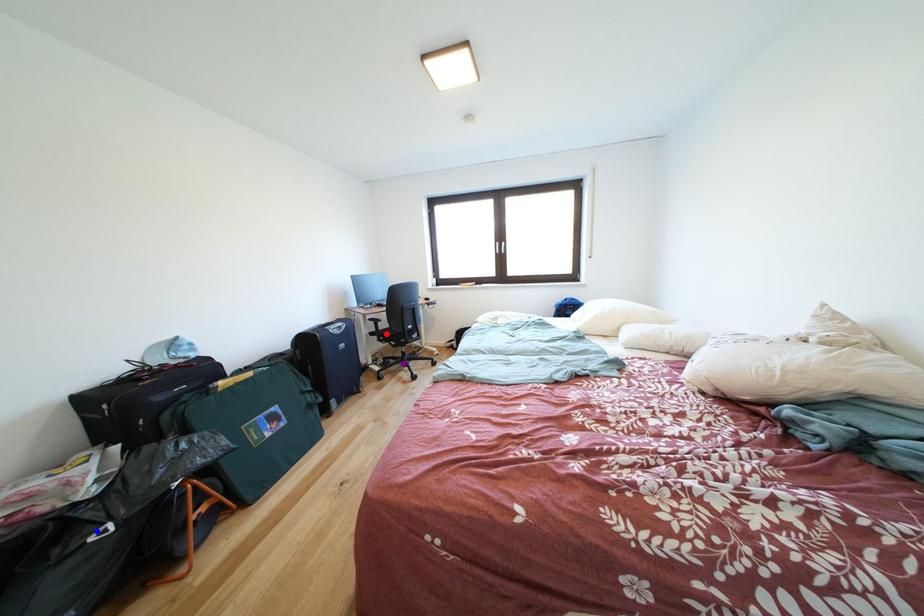
Order these from nearest to farthest:
A) red point
B) purple point
C) blue point

blue point
red point
purple point